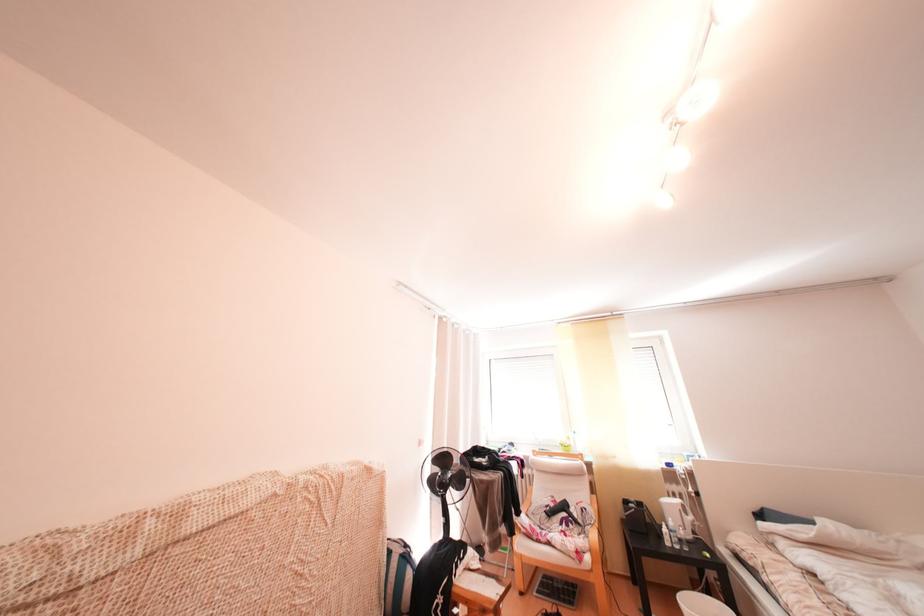
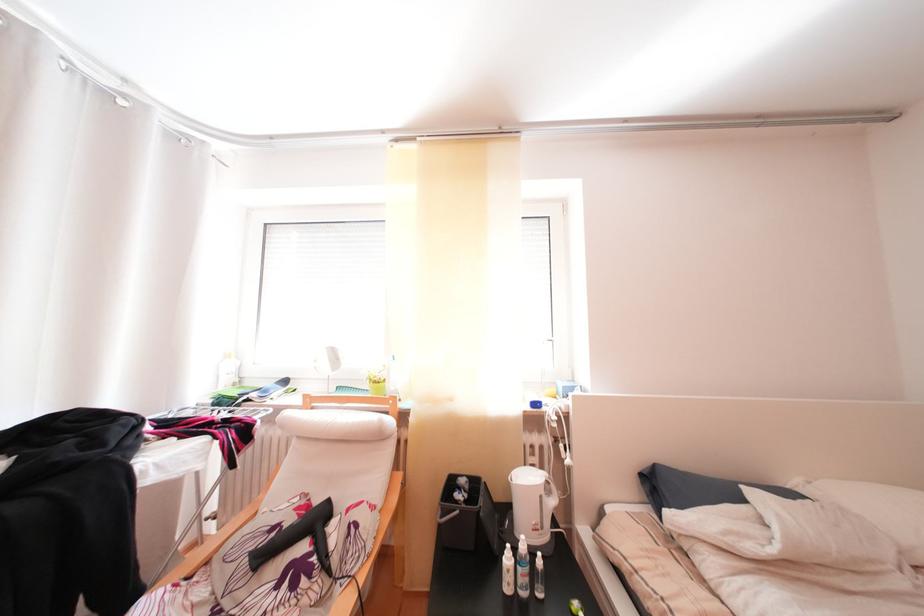
Find the pixel in the second image that matches (x=565, y=509) in the first image.

(301, 525)